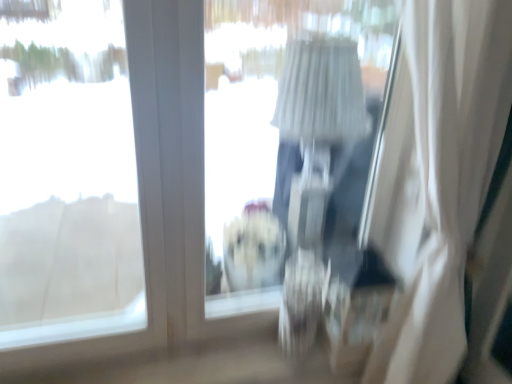
Question: Is transparent glass window at upper left taller or shorter than transparent plastic window screen at center?

Choices:
 (A) short
 (B) tall

Answer: (B)

Question: Is transparent glass window at upper left wider or thinner than transparent plastic window screen at center?

Choices:
 (A) thin
 (B) wide

Answer: (B)

Question: Estimate the real-world distances between objects in this image. Which object is closer to the white sheer curtain at right?

Choices:
 (A) transparent plastic window screen at center
 (B) transparent glass window at upper left

Answer: (A)

Question: Which is farther from the white sheer curtain at right?

Choices:
 (A) transparent plastic window screen at center
 (B) transparent glass window at upper left

Answer: (B)